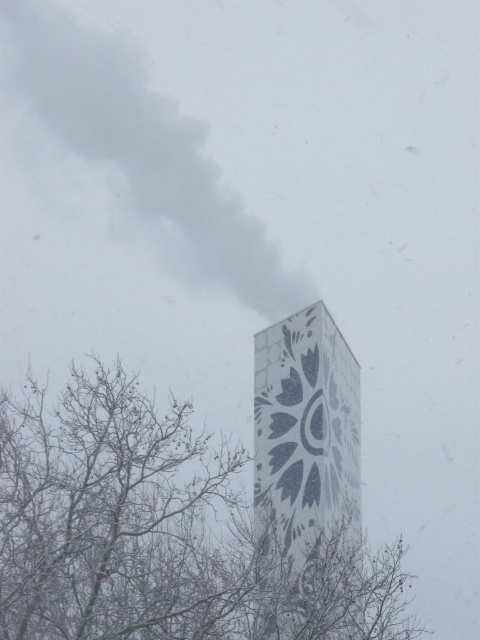
You are a bird flying over the snowy scene. You see the bare branches at center and the gray smoke at upper center. Which object is located below the other?

The bare branches at center is positioned under gray smoke at upper center, so the bare branches at center is below the gray smoke at upper center.